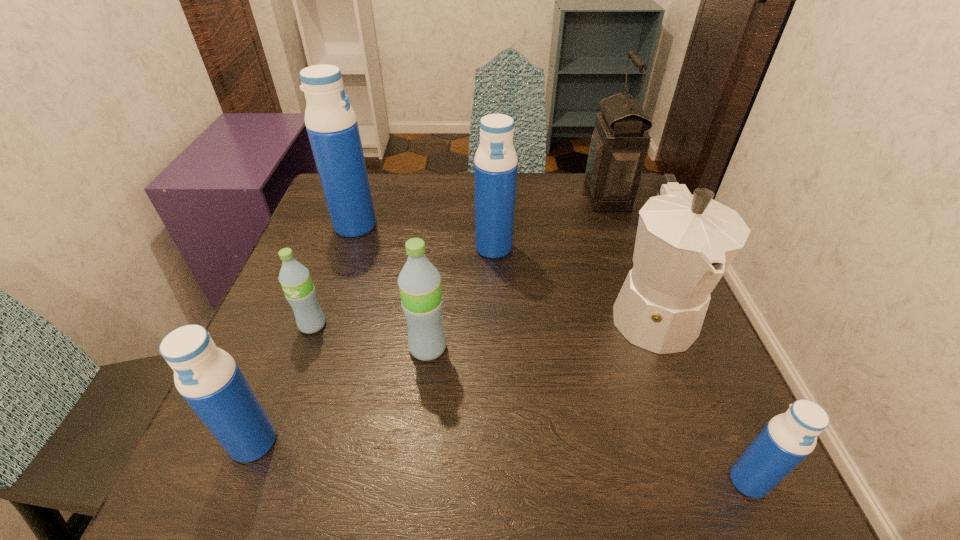
Where is `vacant space situated on the right of the smaller green water bottle`? The image size is (960, 540). vacant space situated on the right of the smaller green water bottle is located at coordinates (469, 325).

Identify the location of vacant region located 0.120m on the back of the smallest blue water bottle. The width and height of the screenshot is (960, 540). (709, 392).

Where is `water bottle at the far edge`? water bottle at the far edge is located at coordinates [x=331, y=123].

This screenshot has height=540, width=960. In order to click on lantern present at the far edge in this screenshot , I will do `click(620, 142)`.

This screenshot has height=540, width=960. Identify the location of lantern that is positioned at the right edge. pyautogui.click(x=620, y=142).

Identify the location of coffeepot at the right edge. (684, 244).

Locate an element on the screen. water bottle that is at the right edge is located at coordinates (788, 438).

You are a GUI agent. You are given a task and a screenshot of the screen. Output one action in this format:
    pyautogui.click(x=<x>, y=<y>)
    Task: Click on the object situated at the far left corner
    The image size is (960, 540).
    Given the screenshot: What is the action you would take?
    pyautogui.click(x=331, y=123)

This screenshot has height=540, width=960. Find the location of `object that is at the near left corner`. object that is at the near left corner is located at coordinates (207, 377).

Find the location of a particular element. The width and height of the screenshot is (960, 540). object that is at the far right corner is located at coordinates (620, 142).